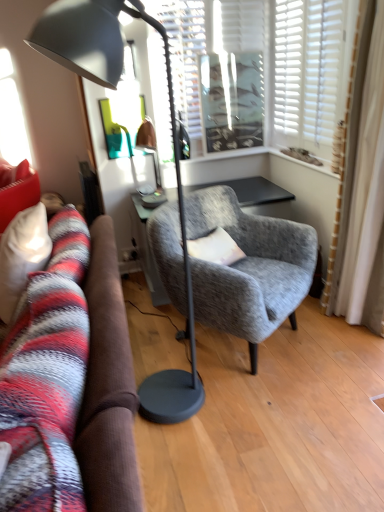
Question: Does white textured blinds at upper center have a lesser width compared to matte black floor lamp at left?

Choices:
 (A) no
 (B) yes

Answer: (B)

Question: Is white textured blinds at upper center facing away from matte black floor lamp at left?

Choices:
 (A) no
 (B) yes

Answer: (A)

Question: Is white textured blinds at upper center aimed at matte black floor lamp at left?

Choices:
 (A) yes
 (B) no

Answer: (A)

Question: Considering the relative sizes of white textured blinds at upper center and matte black floor lamp at left in the image provided, is white textured blinds at upper center smaller than matte black floor lamp at left?

Choices:
 (A) yes
 (B) no

Answer: (A)

Question: From the image's perspective, is white textured blinds at upper center on top of matte black floor lamp at left?

Choices:
 (A) yes
 (B) no

Answer: (A)

Question: Can you confirm if white textured blinds at upper center is taller than matte black floor lamp at left?

Choices:
 (A) yes
 (B) no

Answer: (B)

Question: From a real-world perspective, is matte black floor lamp at left on top of textured gray armchair at center?

Choices:
 (A) no
 (B) yes

Answer: (B)

Question: Is matte black floor lamp at left in contact with textured gray armchair at center?

Choices:
 (A) no
 (B) yes

Answer: (A)

Question: Is matte black floor lamp at left behind textured gray armchair at center?

Choices:
 (A) no
 (B) yes

Answer: (A)

Question: From the image's perspective, is matte black floor lamp at left located above textured gray armchair at center?

Choices:
 (A) no
 (B) yes

Answer: (B)

Question: Could you tell me if matte black floor lamp at left is facing textured gray armchair at center?

Choices:
 (A) yes
 (B) no

Answer: (B)

Question: Does matte black floor lamp at left have a larger size compared to textured gray armchair at center?

Choices:
 (A) yes
 (B) no

Answer: (B)

Question: Does soft gray fabric pillow at center have a lesser height compared to white textured blinds at upper center?

Choices:
 (A) no
 (B) yes

Answer: (B)